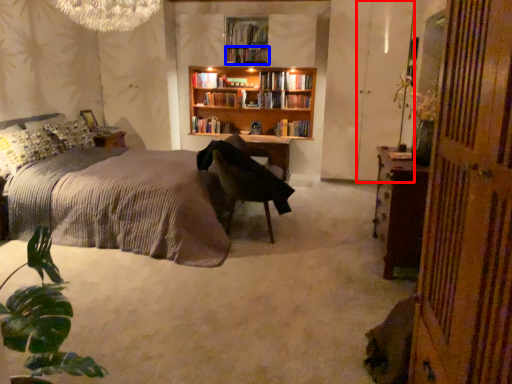
Question: Among these objects, which one is farthest to the camera, screen door (highlighted by a red box) or book (highlighted by a blue box)?

Choices:
 (A) screen door
 (B) book

Answer: (B)